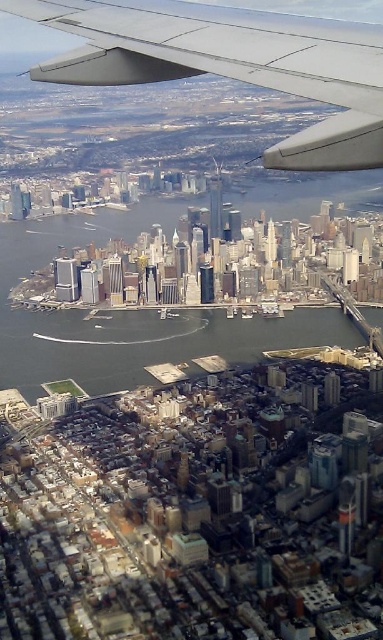
Which is in front, point (57, 323) or point (199, 45)?

Point (57, 323) is in front.

Between green water at center and matte gray wing at upper center, which one appears on the right side from the viewer's perspective?

From the viewer's perspective, matte gray wing at upper center appears more on the right side.

What do you see at coordinates (126, 312) in the screenshot?
I see `green water at center` at bounding box center [126, 312].

Locate an element on the screen. green water at center is located at coordinates (126, 312).